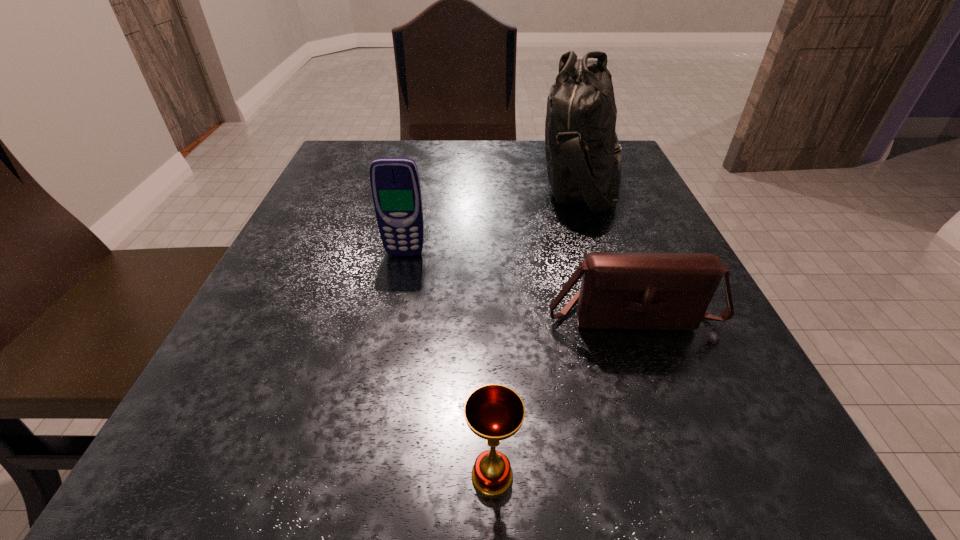
Where is `free space that satisfies the following two spatial constraints: 1. at the front padded panel of the farthest object; 2. on the front flap of the second nearest object`? free space that satisfies the following two spatial constraints: 1. at the front padded panel of the farthest object; 2. on the front flap of the second nearest object is located at coordinates (633, 314).

Identify the location of vacant space that satisfies the following two spatial constraints: 1. at the front padded panel of the farthest object; 2. on the front-facing side of the leftmost object. (611, 253).

The height and width of the screenshot is (540, 960). What are the coordinates of `blank area in the image that satisfies the following two spatial constraints: 1. at the front padded panel of the farther shoulder bag; 2. on the front-facing side of the second farthest object` in the screenshot? It's located at (611, 253).